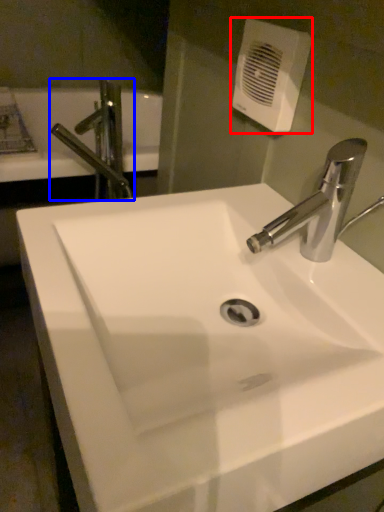
Question: Which point is closer to the camera, hand dryer (highlighted by a red box) or tap (highlighted by a blue box)?

Choices:
 (A) hand dryer
 (B) tap

Answer: (A)